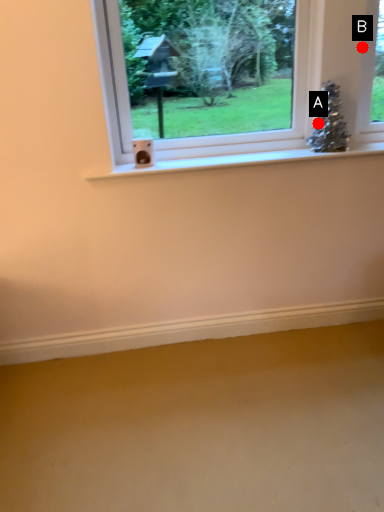
Question: Two points are circled on the image, labeled by A and B beside each circle. Which of the following is the farthest from the observer?

Choices:
 (A) A is further
 (B) B is further

Answer: (A)